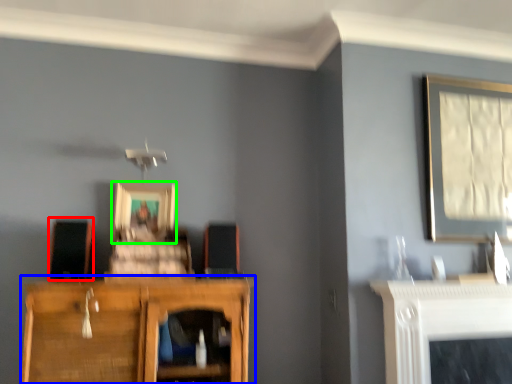
Question: Which is nearer to the speaker (highlighted by a red box)? cupboard (highlighted by a blue box) or picture frame (highlighted by a green box).

Choices:
 (A) cupboard
 (B) picture frame

Answer: (B)